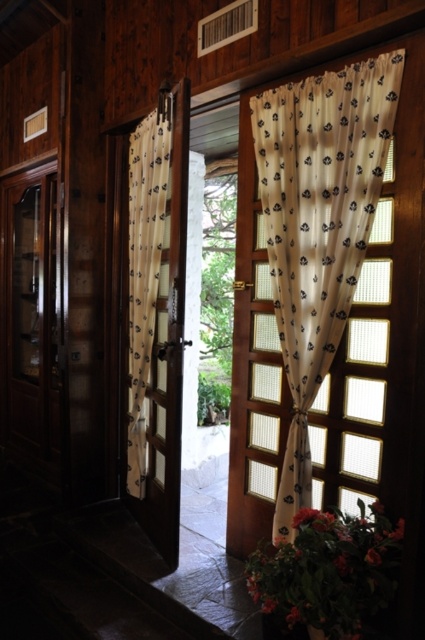
You are standing in the room and see a point marked at coordinates (319,227). Based on the scene, where is this point located?

The point marked at coordinates (319,227) is on the sheer white curtain at right.

You are standing inside the wooden structure and want to know where the sheer white curtain at right is located. Can you describe its position relative to the door?

The sheer white curtain at right is positioned at point 0.355 on the horizontal axis and 0.751 on the vertical axis relative to the door.

You are standing inside the wooden structure and looking towards the open door. You notice two white sheer curtains. The sheer white curtain at right and the white sheer curtain at center. Which curtain is closer to the floor?

The sheer white curtain at right is below the white sheer curtain at center, so the sheer white curtain at right is closer to the floor.